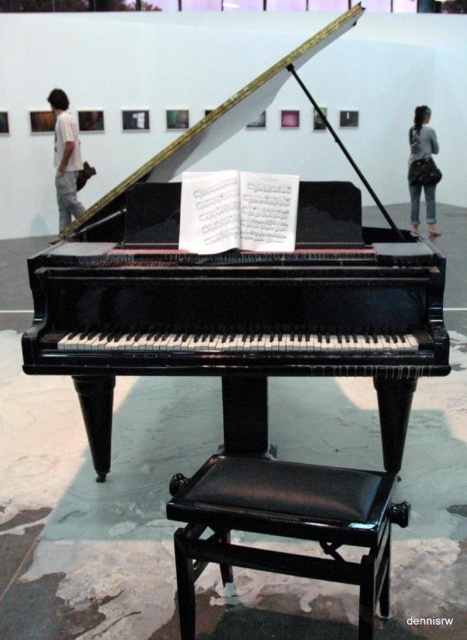
Question: Which object appears closest to the camera in this image?

Choices:
 (A) glossy black piano at center
 (B) white cotton pants at left
 (C) gray fabric bag at upper right
 (D) black leather stool at center

Answer: (D)

Question: Can you confirm if black leather stool at center is positioned above white cotton pants at left?

Choices:
 (A) yes
 (B) no

Answer: (B)

Question: Does glossy black piano at center have a greater width compared to white cotton pants at left?

Choices:
 (A) no
 (B) yes

Answer: (B)

Question: Which of these objects is positioned farthest from the white cotton pants at left?

Choices:
 (A) black leather stool at center
 (B) glossy black piano at center

Answer: (A)

Question: In this image, where is white cotton pants at left located relative to gray fabric bag at upper right?

Choices:
 (A) above
 (B) below

Answer: (B)

Question: Which of the following is the closest to the observer?

Choices:
 (A) white cotton pants at left
 (B) gray fabric bag at upper right
 (C) glossy black piano at center
 (D) black leather stool at center

Answer: (D)